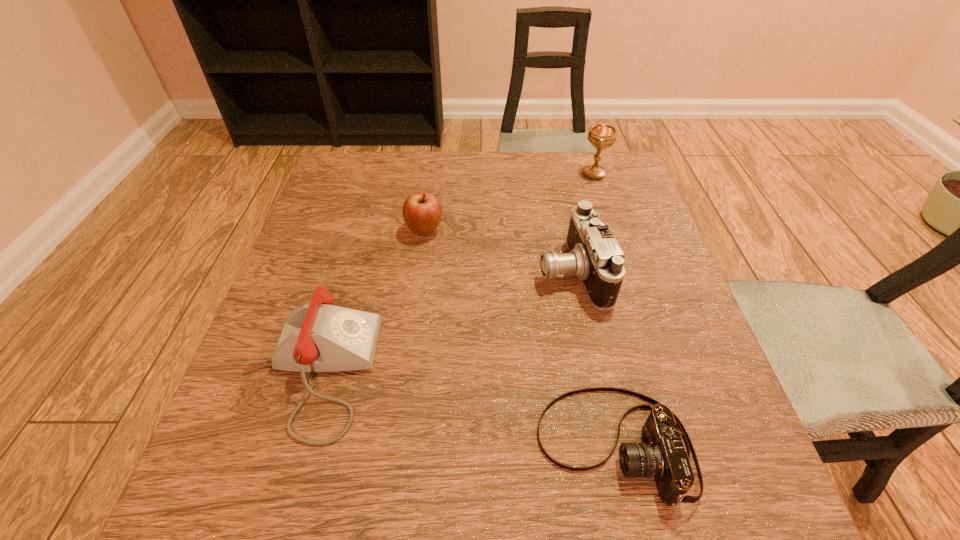
Locate an element on the screen. The image size is (960, 540). object situated at the far right corner is located at coordinates (601, 136).

At what (x,y) coordinates should I click in order to perform the action: click on object that is at the near right corner. Please return your answer as a coordinate pair (x, y). The height and width of the screenshot is (540, 960). Looking at the image, I should click on (663, 456).

I want to click on free location at the far edge, so click(x=555, y=164).

At what (x,y) coordinates should I click in order to perform the action: click on vacant point at the near edge. Please return your answer as a coordinate pair (x, y). This screenshot has height=540, width=960. Looking at the image, I should click on (379, 464).

Where is `blank area at the left edge`? blank area at the left edge is located at coordinates (237, 446).

I want to click on vacant space at the right edge of the desktop, so click(622, 376).

You are a GUI agent. You are given a task and a screenshot of the screen. Output one action in this format:
    pyautogui.click(x=<x>, y=<y>)
    Task: Click on the vacant area at the near left corner
    The height and width of the screenshot is (540, 960).
    Given the screenshot: What is the action you would take?
    pyautogui.click(x=199, y=511)

Identify the location of vacant area at the far right corner of the desktop. (579, 165).

Locate an element on the screen. The image size is (960, 540). free point between the chalice and the apple is located at coordinates (510, 202).

Find the location of `vacant space that is in between the telephone and the farther camera`. vacant space that is in between the telephone and the farther camera is located at coordinates (441, 322).